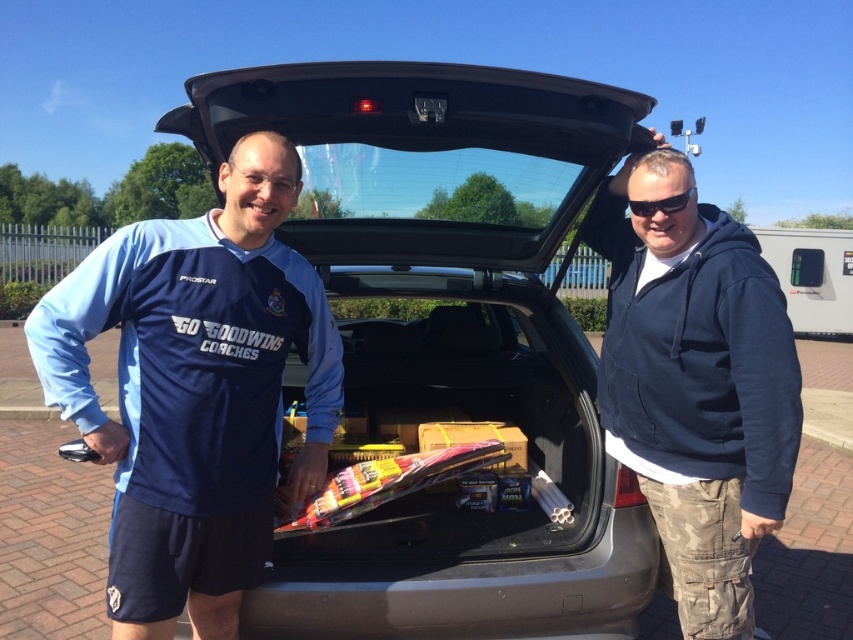
Question: Does matte black car at center have a greater width compared to navy blue hoodie at center?

Choices:
 (A) yes
 (B) no

Answer: (A)

Question: Among these objects, which one is nearest to the camera?

Choices:
 (A) matte black car at center
 (B) black plastic goggles at upper center
 (C) blue jersey at center

Answer: (C)

Question: Which object is farther from the camera taking this photo?

Choices:
 (A) blue jersey at center
 (B) black plastic goggles at upper center
 (C) navy blue hoodie at center
 (D) matte black car at center

Answer: (B)

Question: Is matte black car at center positioned at the back of navy blue hoodie at center?

Choices:
 (A) yes
 (B) no

Answer: (B)

Question: Among these points, which one is nearest to the camera?

Choices:
 (A) (206, 556)
 (B) (654, 481)
 (C) (444, 424)
 (D) (636, 204)

Answer: (A)

Question: Can you confirm if blue jersey at center is positioned above black plastic goggles at upper center?

Choices:
 (A) yes
 (B) no

Answer: (B)